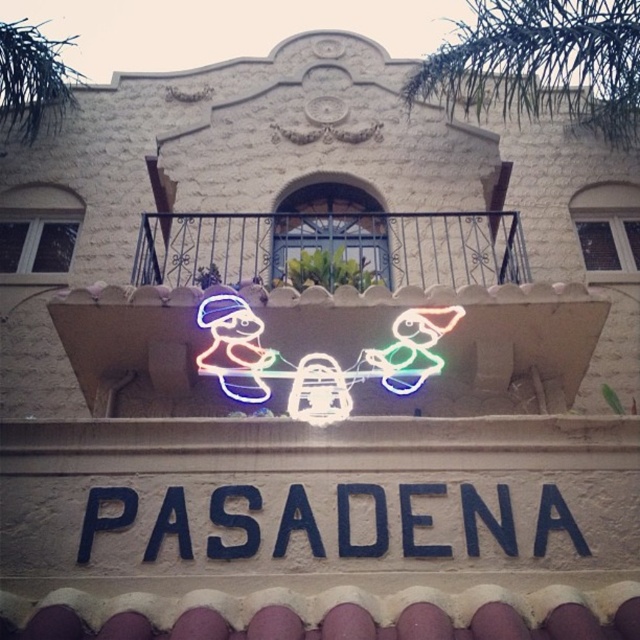
Which of these two, neon lights at center or neonflexible/lightingsanta figures at center, stands shorter?

Standing shorter between the two is neonflexible/lightingsanta figures at center.

Can you confirm if neon lights at center is thinner than neonflexible/lightingsanta figures at center?

Incorrect, neon lights at center's width is not less than neonflexible/lightingsanta figures at center's.

Where is `neon lights at center`? The height and width of the screenshot is (640, 640). neon lights at center is located at coordinates (330, 326).

Is metallic wrought iron at upper center to the right of neonflexible/lightingsanta figures at center from the viewer's perspective?

No, metallic wrought iron at upper center is not to the right of neonflexible/lightingsanta figures at center.

Can you confirm if metallic wrought iron at upper center is positioned below neonflexible/lightingsanta figures at center?

Actually, metallic wrought iron at upper center is above neonflexible/lightingsanta figures at center.

Does point (449, 280) come in front of point (243, 339)?

No, it is not.

Locate an element on the screen. The height and width of the screenshot is (640, 640). metallic wrought iron at upper center is located at coordinates (332, 246).

Consider the image. Who is taller, neon lights at center or blue painted sign at center?

neon lights at center

Who is higher up, neon lights at center or blue painted sign at center?

Positioned higher is neon lights at center.

Find the location of a particular element. The image size is (640, 640). neon lights at center is located at coordinates (330, 326).